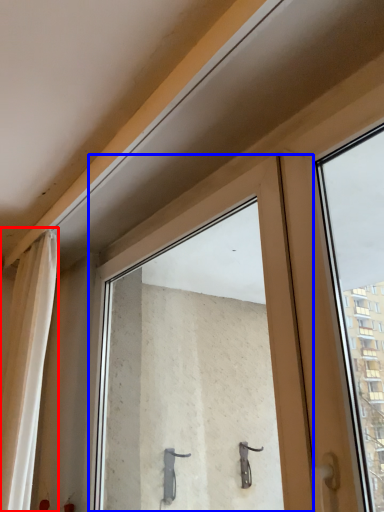
Question: Among these objects, which one is farthest to the camera, curtain (highlighted by a red box) or window (highlighted by a blue box)?

Choices:
 (A) curtain
 (B) window

Answer: (A)